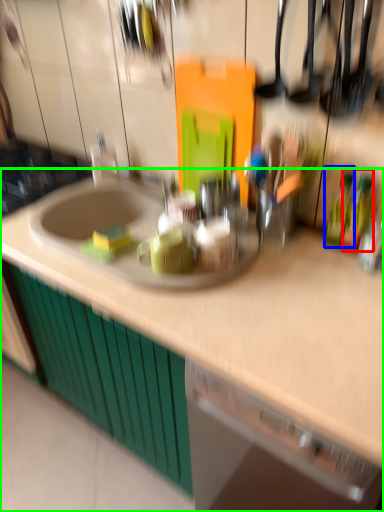
Question: Considering the real-world distances, which object is farthest from bottle (highlighted by a red box)? bottle (highlighted by a blue box) or countertop (highlighted by a green box)?

Choices:
 (A) bottle
 (B) countertop

Answer: (B)